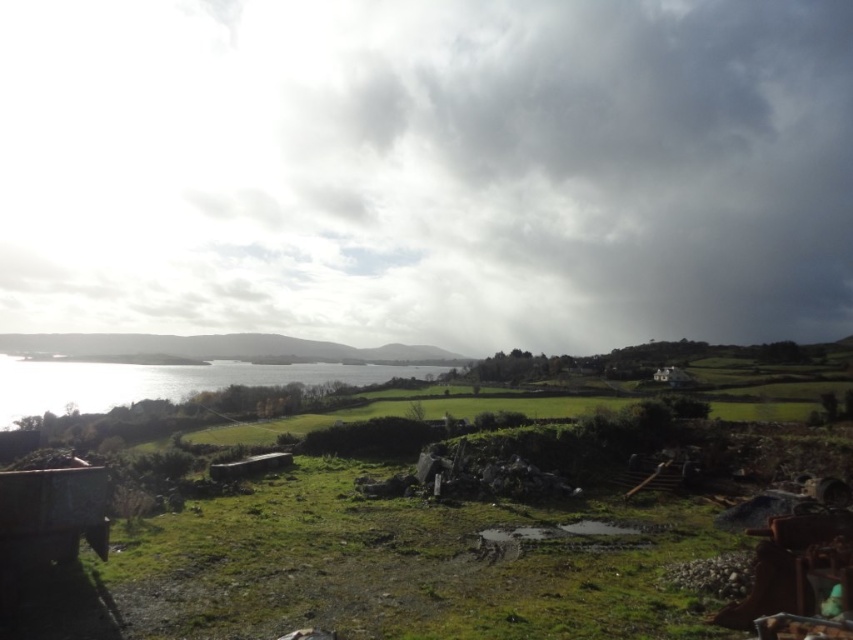
You are a drone operator planning to fly a drone from the shiny silver water at left to the green grassy hillside at lower center. Given that your drone has a maximum flight range of 30 meters, will it be able to reach the destination without needing a recharge?

The shiny silver water at left is 29.62 meters from the green grassy hillside at lower center. Since the distance is less than the drone s 30 meter range, the drone can reach the destination without needing a recharge.

You are an architect designing a new observatory. You need to decide where to place a large telescope so it can view both the cloudy sky at upper center and the shiny silver water at left. Given their positions and sizes, which object will require the telescope to be positioned closer to it?

The telescope needs to be positioned closer to the shiny silver water at left because the cloudy sky at upper center has a greater height and would be visible from a greater distance, while the shiny silver water at left is smaller in height and may require closer proximity for clear viewing.